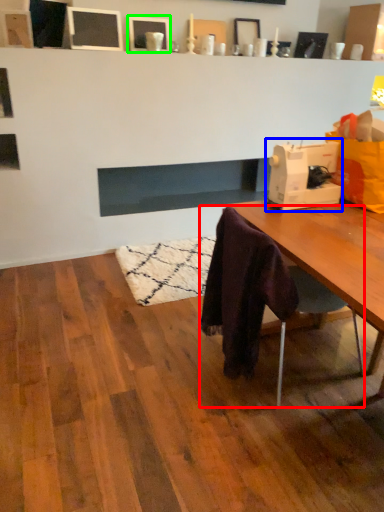
Question: Which object is the closest to the chair (highlighted by a red box)? Choose among these: sewing machine (highlighted by a blue box) or picture frame (highlighted by a green box).

Choices:
 (A) sewing machine
 (B) picture frame

Answer: (A)